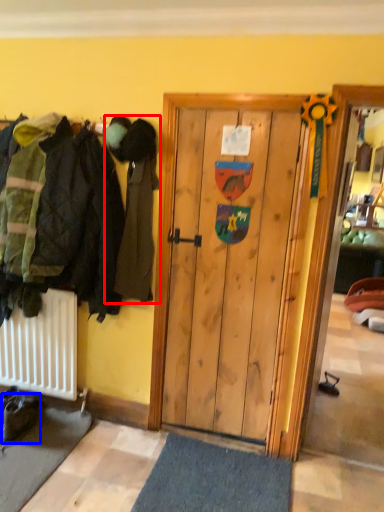
Question: Which point is further to the camera, person (highlighted by a red box) or footwear (highlighted by a blue box)?

Choices:
 (A) person
 (B) footwear

Answer: (B)